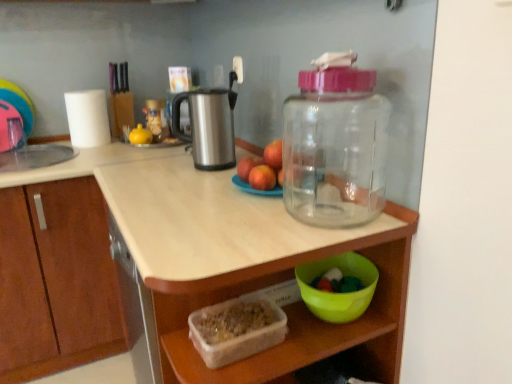
In order to click on vacant space in front of white matte paper towel at upper left in this screenshot , I will do click(59, 155).